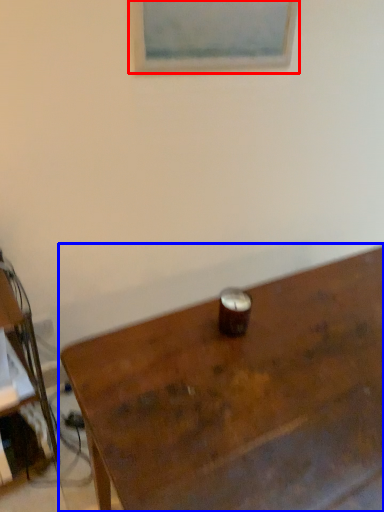
Question: Which object is further to the camera taking this photo, picture frame (highlighted by a red box) or table (highlighted by a blue box)?

Choices:
 (A) picture frame
 (B) table

Answer: (A)